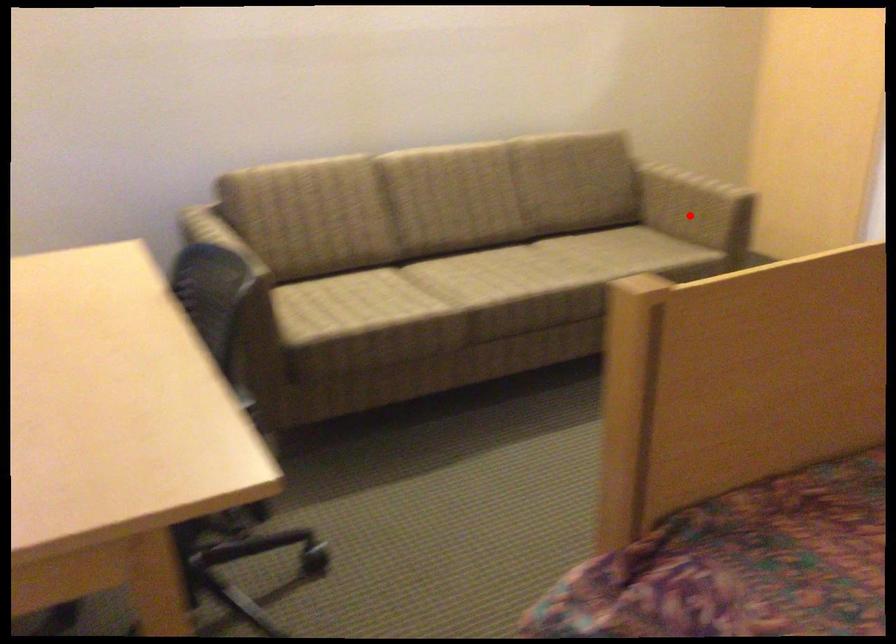
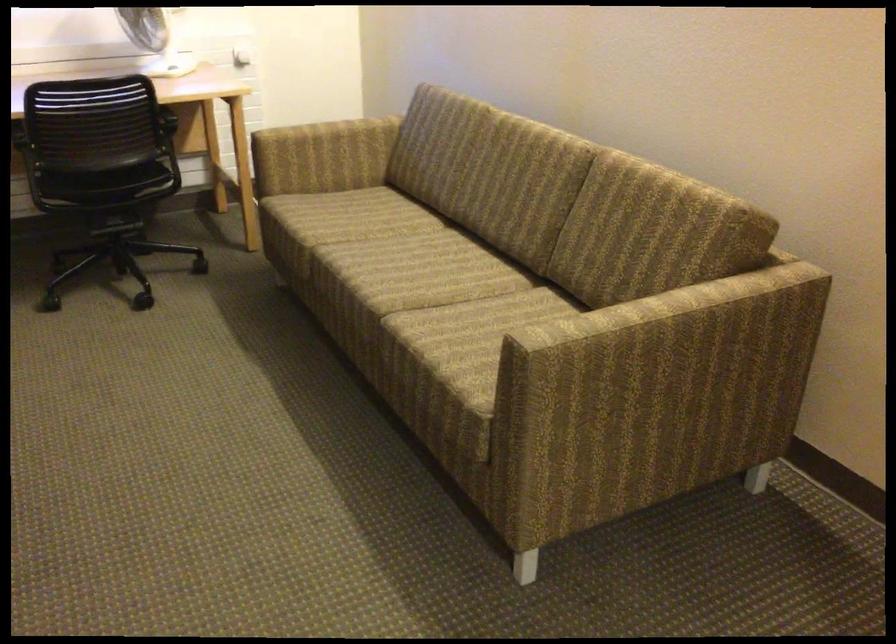
Question: I am providing you with two images of the same scene from different viewpoints. Given a red point in image1, look at the same physical point in image2. Is it:

Choices:
 (A) Closer to the viewpoint
 (B) Farther from the viewpoint

Answer: (A)